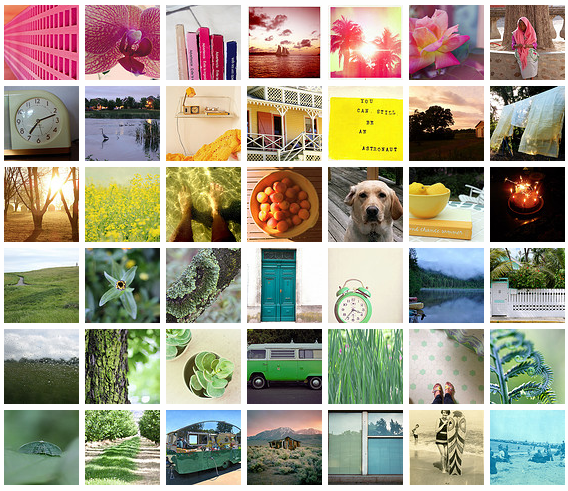
I want to click on the bottom row of photographs, so pyautogui.click(x=43, y=451), pyautogui.click(x=130, y=449), pyautogui.click(x=207, y=449), pyautogui.click(x=286, y=452), pyautogui.click(x=357, y=456), pyautogui.click(x=449, y=454), pyautogui.click(x=519, y=455).